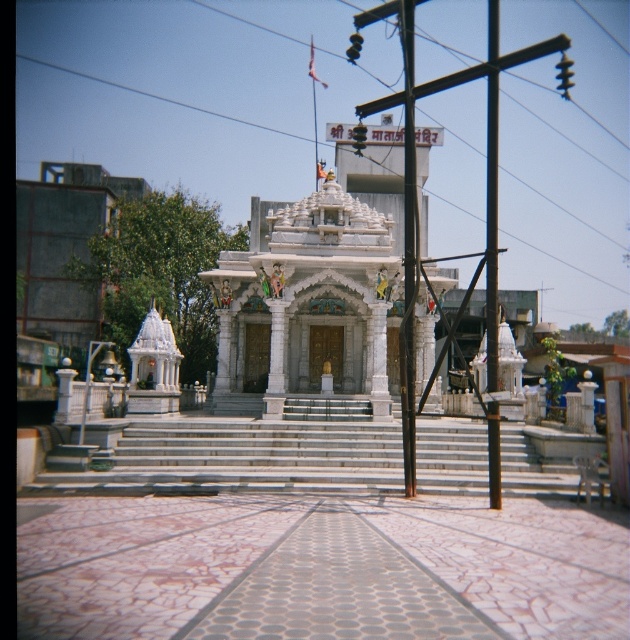
Question: Which point is closer to the camera?

Choices:
 (A) white marble hindu temple at center
 (B) white marble stairs at center
 (C) metallic pole at center

Answer: (C)

Question: Where is white marble hindu temple at center located in relation to white marble stairs at center in the image?

Choices:
 (A) left
 (B) right

Answer: (A)

Question: Estimate the real-world distances between objects in this image. Which object is farther from the metallic pole at center?

Choices:
 (A) white marble hindu temple at center
 (B) white marble stairs at center
 (C) black metallic pole at center

Answer: (A)

Question: Can you confirm if white marble stairs at center is positioned above metallic pole at center?

Choices:
 (A) no
 (B) yes

Answer: (A)

Question: Considering the real-world distances, which object is closest to the white marble hindu temple at center?

Choices:
 (A) white marble stairs at center
 (B) metallic pole at center
 (C) black metallic pole at center

Answer: (C)

Question: Can you confirm if black metallic pole at center is positioned below metallic pole at center?

Choices:
 (A) no
 (B) yes

Answer: (B)